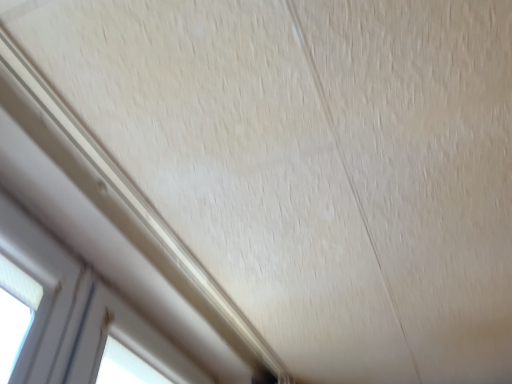
What is the approximate width of white plastic window at lower left, which ranks as the 1th window in front-to-back order?

white plastic window at lower left, which ranks as the 1th window in front-to-back order, is 2.54 inches in width.

Image resolution: width=512 pixels, height=384 pixels. What are the coordinates of `white plastic window at lower left, which is the 2th window in right-to-left order` in the screenshot? It's located at (39, 288).

Measure the distance between white plastic window at lower left, the second window positioned from the back, and camera.

white plastic window at lower left, the second window positioned from the back, is 35.18 inches away from camera.

This screenshot has height=384, width=512. What do you see at coordinates (39, 288) in the screenshot? I see `white plastic window at lower left, which ranks as the 1th window in front-to-back order` at bounding box center [39, 288].

What is the approximate height of white plastic window at lower left, which ranks as the 1th window in front-to-back order?

white plastic window at lower left, which ranks as the 1th window in front-to-back order, is 6.29 inches tall.

How much space does white plastic window at lower left, arranged as the second window when viewed from the front, occupy vertically?

9.18 inches.

Describe the element at coordinates (124, 347) in the screenshot. I see `white plastic window at lower left, the first window positioned from the bottom` at that location.

Find the location of a particular element. white plastic window at lower left, placed as the first window when sorted from right to left is located at coordinates (124, 347).

Find the location of a particular element. Image resolution: width=512 pixels, height=384 pixels. white plastic window at lower left, which ranks as the 1th window in front-to-back order is located at coordinates (39, 288).

Which is more to the right, white plastic window at lower left, acting as the second window starting from the bottom, or white plastic window at lower left, the 1th window in the back-to-front sequence?

white plastic window at lower left, the 1th window in the back-to-front sequence.

Is white plastic window at lower left, which is counted as the 1th window, starting from the top, behind white plastic window at lower left, the second window from the top?

No, white plastic window at lower left, which is counted as the 1th window, starting from the top, is closer to the viewer.

Is point (53, 281) farther from viewer compared to point (86, 368)?

No, it is not.

From the image's perspective, is white plastic window at lower left, which is counted as the 1th window, starting from the top, below white plastic window at lower left, the 1th window in the back-to-front sequence?

No, from the image's perspective, white plastic window at lower left, which is counted as the 1th window, starting from the top, is not below white plastic window at lower left, the 1th window in the back-to-front sequence.

From a real-world perspective, is white plastic window at lower left, positioned as the 1th window in left-to-right order, positioned over white plastic window at lower left, the second window from the top, based on gravity?

Yes, from a real-world perspective, white plastic window at lower left, positioned as the 1th window in left-to-right order, is over white plastic window at lower left, the second window from the top

In terms of width, does white plastic window at lower left, positioned as the 1th window in left-to-right order, look wider or thinner when compared to white plastic window at lower left, marked as the second window in a left-to-right arrangement?

white plastic window at lower left, positioned as the 1th window in left-to-right order, is thinner than white plastic window at lower left, marked as the second window in a left-to-right arrangement.

Between white plastic window at lower left, the second window positioned from the back, and white plastic window at lower left, placed as the first window when sorted from right to left, which one has less height?

With less height is white plastic window at lower left, the second window positioned from the back.

Who is smaller, white plastic window at lower left, acting as the second window starting from the bottom, or white plastic window at lower left, arranged as the second window when viewed from the front?

With smaller size is white plastic window at lower left, acting as the second window starting from the bottom.

Would you say white plastic window at lower left, which is counted as the 1th window, starting from the top, contains white plastic window at lower left, the second window from the top?

No.

Would you consider white plastic window at lower left, which ranks as the 1th window in front-to-back order, to be distant from white plastic window at lower left, the first window positioned from the bottom?

No, there isn't a large distance between white plastic window at lower left, which ranks as the 1th window in front-to-back order, and white plastic window at lower left, the first window positioned from the bottom.

Does white plastic window at lower left, the second window positioned from the back, turn towards white plastic window at lower left, placed as the first window when sorted from right to left?

No, white plastic window at lower left, the second window positioned from the back, is not aimed at white plastic window at lower left, placed as the first window when sorted from right to left.

Can you tell me how much white plastic window at lower left, the second window positioned from the back, and white plastic window at lower left, the first window positioned from the bottom, differ in facing direction?

0.00127 degrees separate the facing orientations of white plastic window at lower left, the second window positioned from the back, and white plastic window at lower left, the first window positioned from the bottom.

In order to click on window behind the white plastic window at lower left, acting as the second window starting from the bottom in this screenshot , I will do `click(124, 347)`.

Which object is positioned more to the left, white plastic window at lower left, arranged as the second window when viewed from the front, or white plastic window at lower left, which is counted as the 1th window, starting from the top?

Positioned to the left is white plastic window at lower left, which is counted as the 1th window, starting from the top.

Considering their positions, is white plastic window at lower left, placed as the first window when sorted from right to left, located in front of or behind white plastic window at lower left, the second window positioned from the back?

Clearly, white plastic window at lower left, placed as the first window when sorted from right to left, is behind white plastic window at lower left, the second window positioned from the back.

Does point (147, 329) appear closer or farther from the camera than point (59, 311)?

Clearly, point (147, 329) is more distant from the camera than point (59, 311).

From the image's perspective, is white plastic window at lower left, the second window from the top, located above white plastic window at lower left, positioned as the 1th window in left-to-right order?

No, from the image's perspective, white plastic window at lower left, the second window from the top, is not above white plastic window at lower left, positioned as the 1th window in left-to-right order.

Consider the image. From a real-world perspective, is white plastic window at lower left, placed as the first window when sorted from right to left, on top of white plastic window at lower left, acting as the second window starting from the bottom?

No, from a real-world perspective, white plastic window at lower left, placed as the first window when sorted from right to left, is not over white plastic window at lower left, acting as the second window starting from the bottom

Considering the relative sizes of white plastic window at lower left, the second window from the top, and white plastic window at lower left, which is the 2th window in right-to-left order, in the image provided, is white plastic window at lower left, the second window from the top, wider than white plastic window at lower left, which is the 2th window in right-to-left order,?

Indeed, white plastic window at lower left, the second window from the top, has a greater width compared to white plastic window at lower left, which is the 2th window in right-to-left order.

Does white plastic window at lower left, the first window positioned from the bottom, have a greater height compared to white plastic window at lower left, the second window positioned from the back?

Yes.

From the picture: Considering the sizes of objects white plastic window at lower left, the 1th window in the back-to-front sequence, and white plastic window at lower left, which is the 2th window in right-to-left order, in the image provided, who is smaller, white plastic window at lower left, the 1th window in the back-to-front sequence, or white plastic window at lower left, which is the 2th window in right-to-left order,?

With smaller size is white plastic window at lower left, which is the 2th window in right-to-left order.

Do you think white plastic window at lower left, the 1th window in the back-to-front sequence, is within white plastic window at lower left, which is counted as the 1th window, starting from the top, or outside of it?

white plastic window at lower left, the 1th window in the back-to-front sequence, is not enclosed by white plastic window at lower left, which is counted as the 1th window, starting from the top.

Does white plastic window at lower left, the first window positioned from the bottom, touch white plastic window at lower left, which is counted as the 1th window, starting from the top?

white plastic window at lower left, the first window positioned from the bottom, is not next to white plastic window at lower left, which is counted as the 1th window, starting from the top, and they're not touching.

Is white plastic window at lower left, the first window positioned from the bottom, aimed at white plastic window at lower left, acting as the second window starting from the bottom?

No, white plastic window at lower left, the first window positioned from the bottom, is not turned towards white plastic window at lower left, acting as the second window starting from the bottom.

In the image, there is a white plastic window at lower left, which is counted as the 1th window, starting from the top. Where is `window below it (from a real-world perspective)`? The width and height of the screenshot is (512, 384). window below it (from a real-world perspective) is located at coordinates (124, 347).

Find the location of a particular element. window that appears above the white plastic window at lower left, the 1th window in the back-to-front sequence (from a real-world perspective) is located at coordinates (39, 288).

Where is `window that appears above the white plastic window at lower left, placed as the first window when sorted from right to left (from the image's perspective)`? The height and width of the screenshot is (384, 512). window that appears above the white plastic window at lower left, placed as the first window when sorted from right to left (from the image's perspective) is located at coordinates (39, 288).